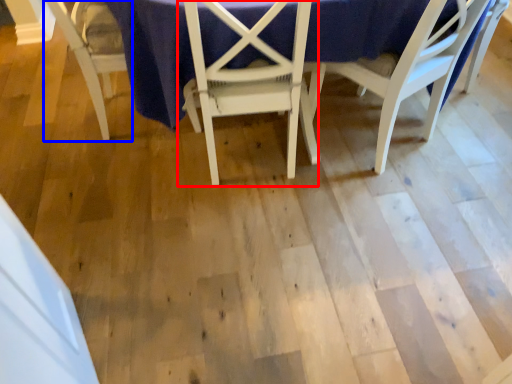
Question: Among these objects, which one is farthest to the camera, chair (highlighted by a red box) or chair (highlighted by a blue box)?

Choices:
 (A) chair
 (B) chair

Answer: (B)